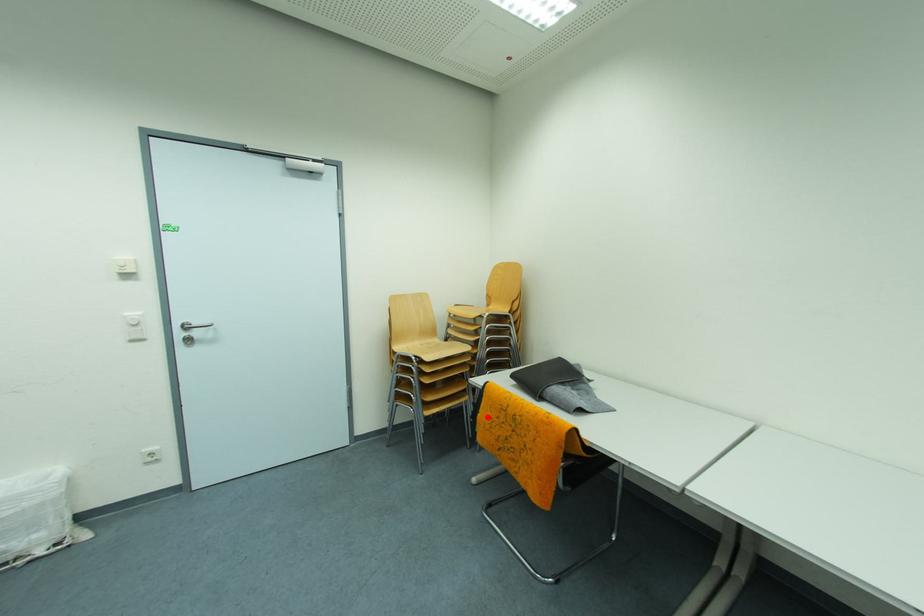
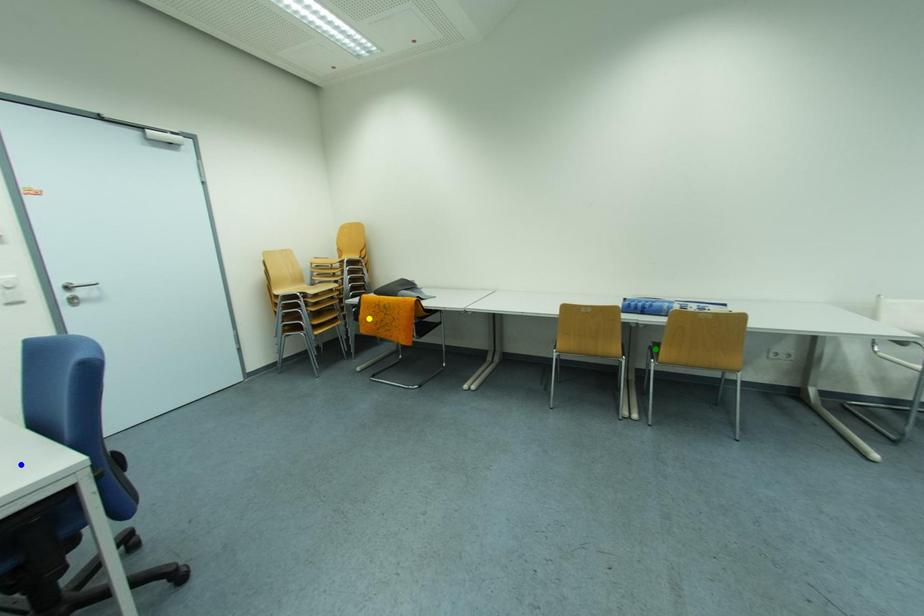
Question: I am providing you with two images of the same scene from different viewpoints. A red point is marked on the first image. You are given multiple points on the second image. In image 2, which mark is for the same physical point as the one in image 1?

Choices:
 (A) blue point
 (B) yellow point
 (C) green point

Answer: (B)